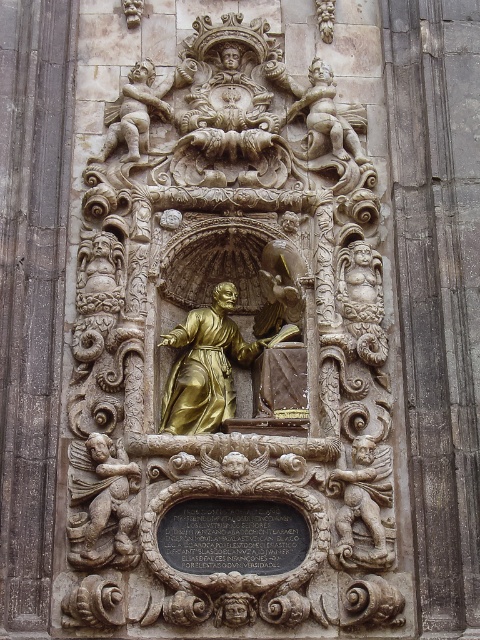
You are an art conservator assessing the space requirements for transporting these two items. Given that the gold polished statue at center and the carved stone cherub at lower left must be moved, which object requires a wider storage container based on their dimensions?

The gold polished statue at center requires a wider storage container because its width is larger than that of the carved stone cherub at lower left.

You are an art conservator examining the stone relief sculpture. You need to clean both the gold polished statue at center and the carved stone cherub at lower left. Which object should you start with if you want to work from the bottom up?

The carved stone cherub at lower left should be cleaned first since it is positioned below the gold polished statue at center, allowing you to work from the bottom upward.